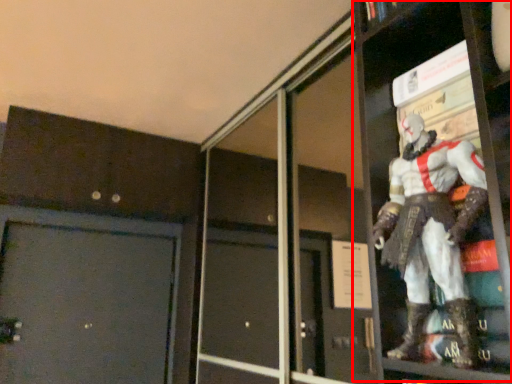
Question: From the image, what is the correct spatial relationship of shelf (annotated by the red box) in relation to screen door?

Choices:
 (A) right
 (B) left

Answer: (A)